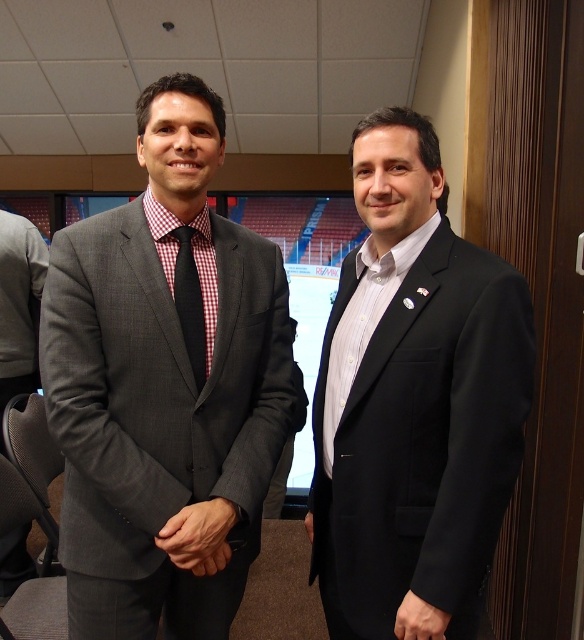
Question: From the image, what is the correct spatial relationship of matte black hand at lower right in relation to black matte hand at center?

Choices:
 (A) above
 (B) below

Answer: (B)

Question: Does matte gray suit at left have a greater width compared to black matte suit at right?

Choices:
 (A) no
 (B) yes

Answer: (B)

Question: Which object is the farthest from the matte gray suit at left?

Choices:
 (A) matte black hand at center
 (B) black matte suit at right

Answer: (B)

Question: Can you confirm if matte gray suit at left is bigger than matte black hand at center?

Choices:
 (A) yes
 (B) no

Answer: (A)

Question: Estimate the real-world distances between objects in this image. Which object is closer to the matte black hand at lower right?

Choices:
 (A) black matte hand at center
 (B) matte black hand at center
 (C) black matte suit at right
 (D) red checkered tie at left

Answer: (A)

Question: Which of the following is the closest to the observer?

Choices:
 (A) (192, 288)
 (B) (185, 497)
 (C) (308, 529)

Answer: (B)